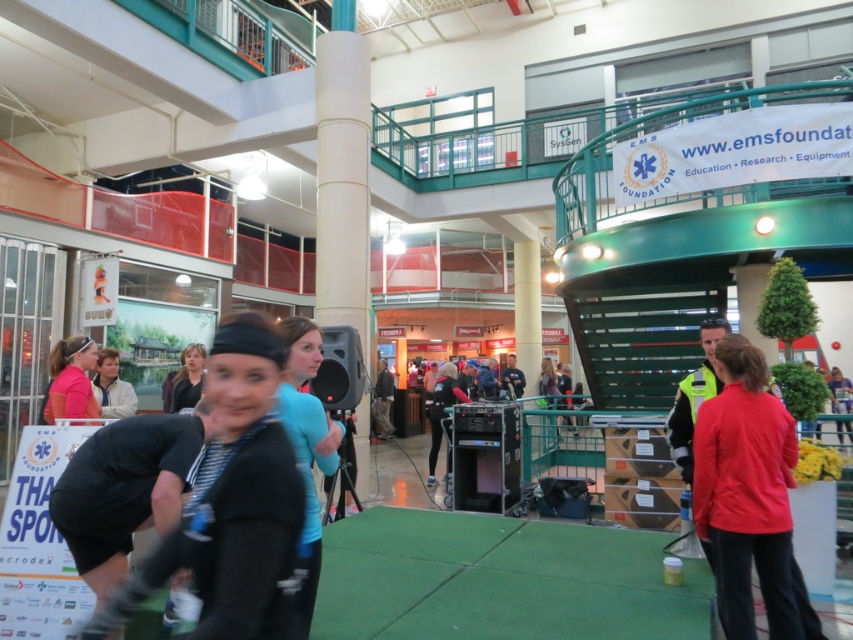
Is red matte jacket at center above pink fabric headband at upper left?

Incorrect, red matte jacket at center is not positioned above pink fabric headband at upper left.

Between point (776, 492) and point (64, 406), which one is positioned in front?

Point (776, 492) is in front.

The height and width of the screenshot is (640, 853). Identify the location of red matte jacket at center. (747, 497).

Is red matte jacket at center closer to camera compared to light blue shirt at center?

Yes, red matte jacket at center is in front of light blue shirt at center.

Is red matte jacket at center smaller than light blue shirt at center?

No.

Who is more distant from viewer, (741, 524) or (97, 358)?

The point (97, 358) is more distant.

The height and width of the screenshot is (640, 853). Find the location of `red matte jacket at center`. red matte jacket at center is located at coordinates (747, 497).

Does black matte headband at center appear on the left side of light blue shirt at center?

In fact, black matte headband at center is to the right of light blue shirt at center.

Locate an element on the screen. The image size is (853, 640). black matte headband at center is located at coordinates (233, 504).